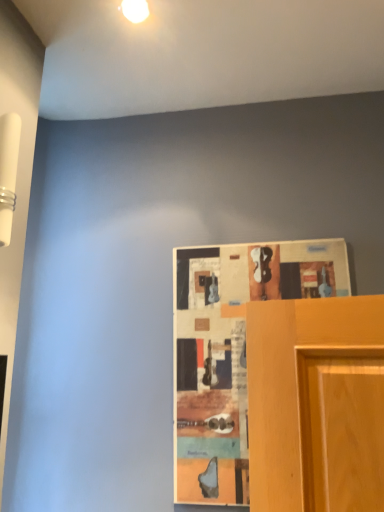
The height and width of the screenshot is (512, 384). I want to click on wooden collage at upper right, so click(231, 351).

What do you see at coordinates (231, 351) in the screenshot? I see `wooden collage at upper right` at bounding box center [231, 351].

Where is `wooden collage at upper right`? Image resolution: width=384 pixels, height=512 pixels. wooden collage at upper right is located at coordinates (231, 351).